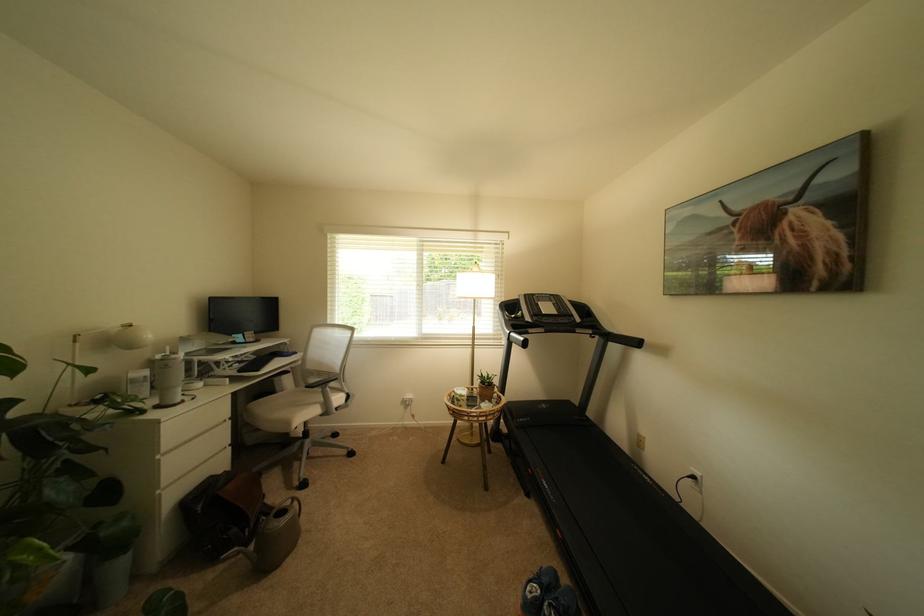
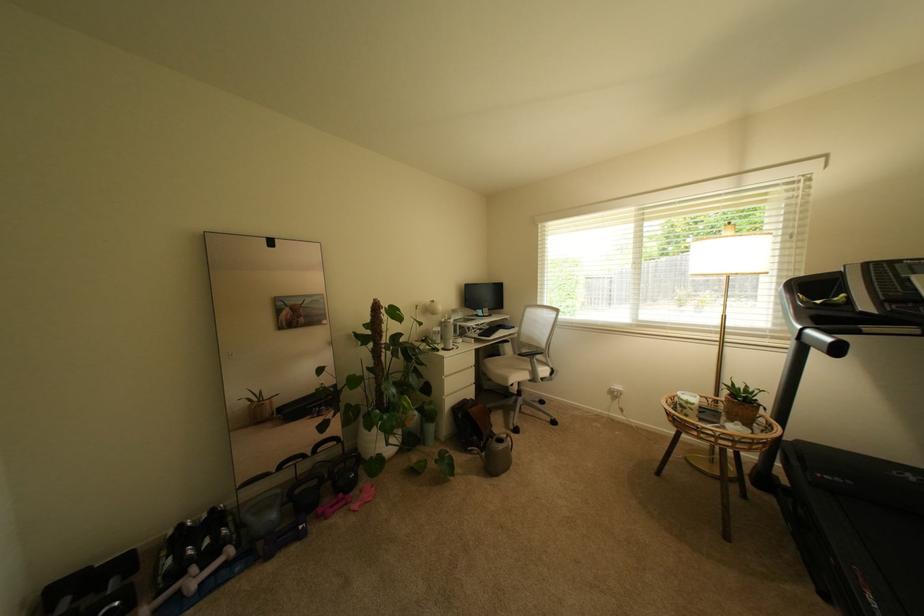
Find the pixel in the second image that matches (168,496) in the first image.

(453, 400)